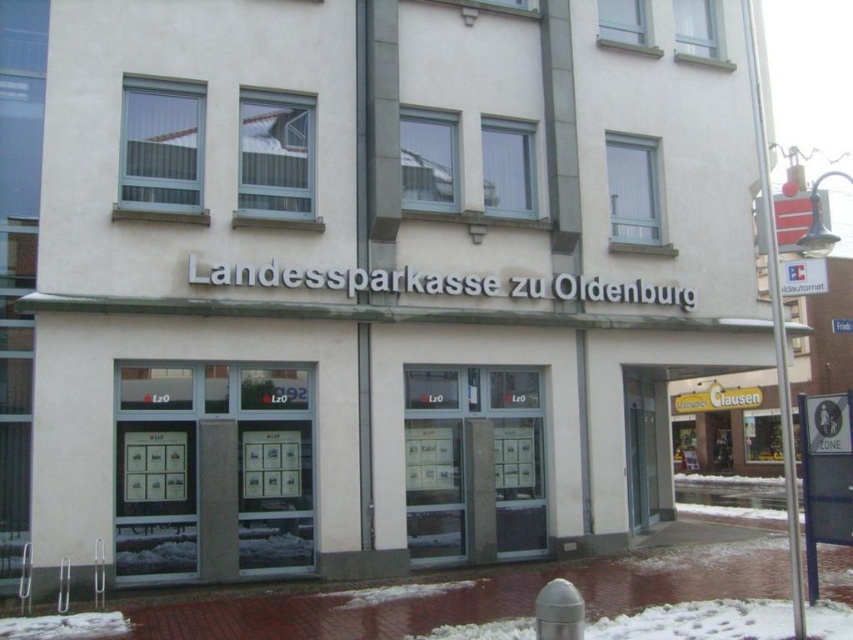
You are standing in front of the Landessparkasse zu Oldenburg building and want to enter through the transparent glass doors at center. To reach them, you need to walk past the transparent glass windows at center. Are the doors closer to you than the windows?

The transparent glass windows at center are closer to the viewer than the transparent glass doors at center, so the doors are further away than the windows.

You are a delivery person trying to enter the Landessparkasse zu Oldenburg branch. You need to deliver a package to the front desk. Which object should you approach first, the transparent glass windows at center or the transparent glass doors at center?

You should approach the transparent glass doors at center first because the transparent glass windows at center are larger in size and might be part of the display rather than an entrance. The doors are typically used for entry, so they are the correct choice for delivering the package.

You are a delivery person carrying a large package that requires you to enter the building through the transparent glass doors at center. However, you notice the transparent glass windows at center nearby. Which one is taller so you can check if you can pass through?

The transparent glass doors at center are taller than the transparent glass windows at center, so you can pass through the transparent glass doors at center with your large package.